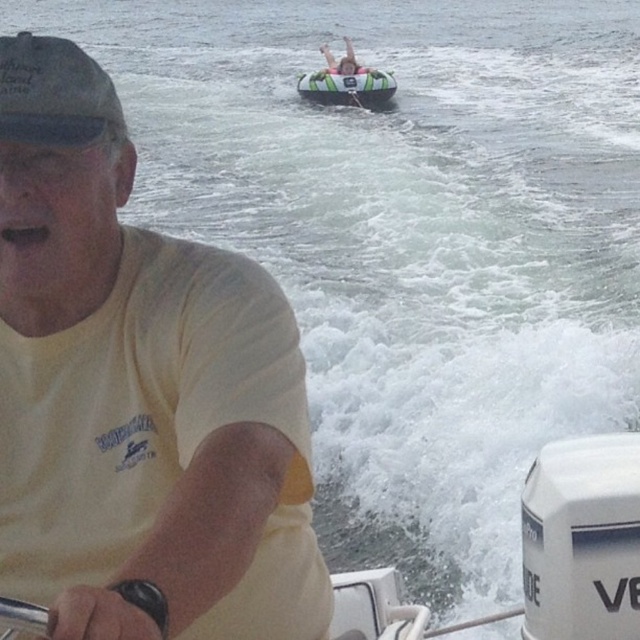
Question: Which of the following is the closest to the observer?

Choices:
 (A) [326, 58]
 (B) [74, 435]
 (C) [330, 99]
 (D) [60, 122]

Answer: (D)

Question: Based on their relative distances, which object is nearer to the smooth skin human at upper center?

Choices:
 (A) yellow t-shirt at center
 (B) white plastic motor at lower right
 (C) dark gray matte baseball cap at upper left
 (D) green inflatable raft at upper center

Answer: (D)

Question: Is white plastic motor at lower right to the right of green inflatable raft at upper center from the viewer's perspective?

Choices:
 (A) yes
 (B) no

Answer: (A)

Question: Can you confirm if yellow t-shirt at center is positioned to the right of dark gray matte baseball cap at upper left?

Choices:
 (A) yes
 (B) no

Answer: (A)

Question: Which of the following is the farthest from the observer?

Choices:
 (A) white plastic motor at lower right
 (B) yellow t-shirt at center

Answer: (A)

Question: Is green inflatable raft at upper center further to camera compared to smooth skin human at upper center?

Choices:
 (A) yes
 (B) no

Answer: (B)